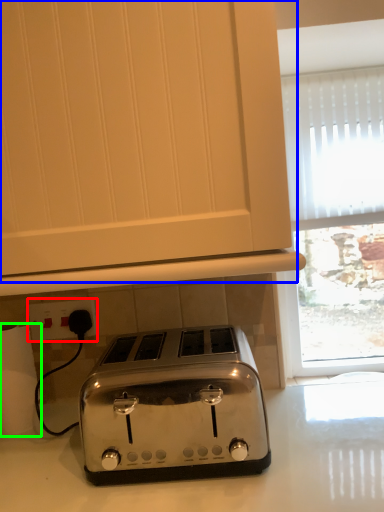
Question: Which object is positioned farthest from electric outlet (highlighted by a red box)? Select from oven (highlighted by a blue box) and toilet paper (highlighted by a green box).

Choices:
 (A) oven
 (B) toilet paper

Answer: (A)